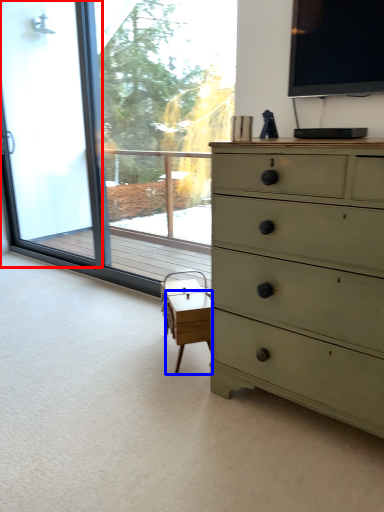
Question: Which object is closer to the camera taking this photo, screen door (highlighted by a red box) or table (highlighted by a blue box)?

Choices:
 (A) screen door
 (B) table

Answer: (B)